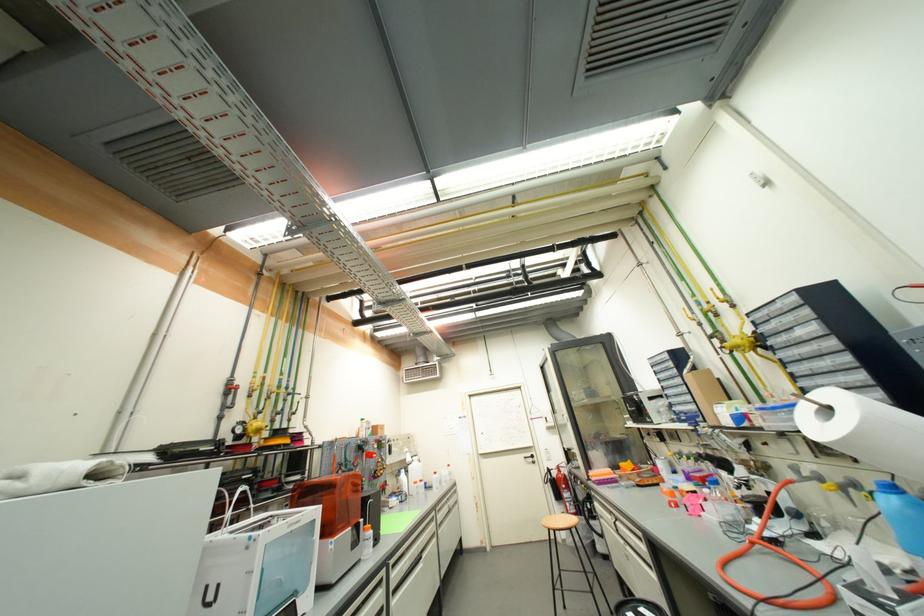
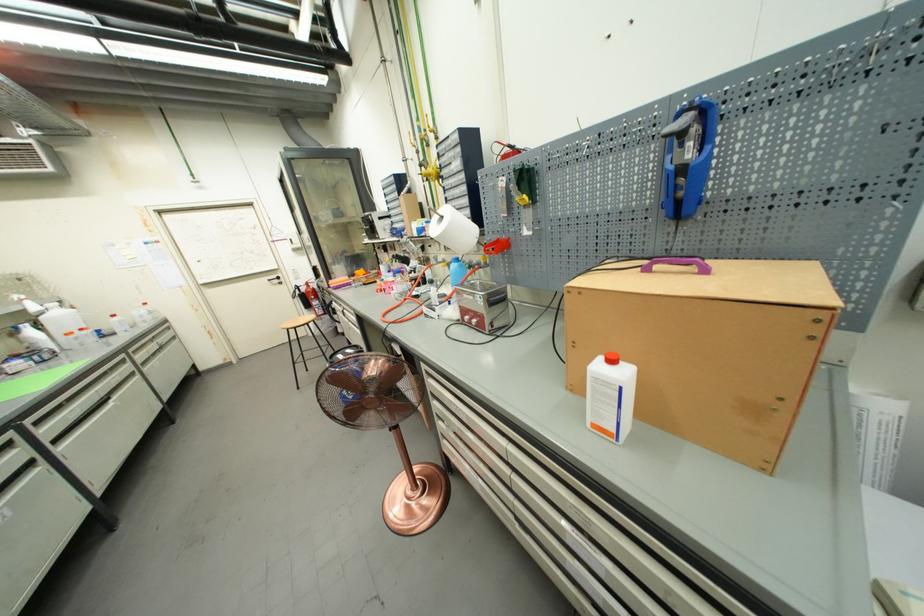
In the second image, find the point that corresponds to pixel 560 476 in the first image.

(309, 291)